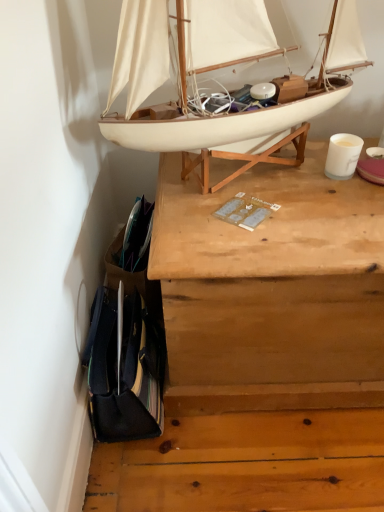
You are a GUI agent. You are given a task and a screenshot of the screen. Output one action in this format:
    pyautogui.click(x=<x>, y=<y>)
    Task: Click on the white matte boat at upper center
    
    Given the screenshot: What is the action you would take?
    pyautogui.click(x=219, y=114)

This screenshot has width=384, height=512. What do you see at coordinates (219, 114) in the screenshot?
I see `white matte boat at upper center` at bounding box center [219, 114].

The height and width of the screenshot is (512, 384). What do you see at coordinates (266, 324) in the screenshot?
I see `wooden chest at upper center` at bounding box center [266, 324].

From the picture: Measure the distance between point (x=233, y=258) and camera.

Point (x=233, y=258) is 29.06 inches from camera.

Find the location of a particular element. wooden chest at upper center is located at coordinates (266, 324).

Locate an element on the screen. white matte boat at upper center is located at coordinates point(219,114).

Does wooden chest at upper center appear on the right side of white matte boat at upper center?

Yes.

Is the depth of wooden chest at upper center greater than that of white matte boat at upper center?

Yes, wooden chest at upper center is behind white matte boat at upper center.

Does point (202, 426) appear closer or farther from the camera than point (227, 133)?

Point (202, 426) is positioned farther from the camera compared to point (227, 133).

Looking at this image, from the image's perspective, which object appears higher, wooden chest at upper center or white matte boat at upper center?

white matte boat at upper center.

From a real-world perspective, is wooden chest at upper center physically above white matte boat at upper center?

No, from a real-world perspective, wooden chest at upper center is not on top of white matte boat at upper center.

Considering the relative sizes of wooden chest at upper center and white matte boat at upper center in the image provided, is wooden chest at upper center wider than white matte boat at upper center?

Yes.

Does wooden chest at upper center have a lesser height compared to white matte boat at upper center?

No, wooden chest at upper center is not shorter than white matte boat at upper center.

Can you confirm if wooden chest at upper center is bigger than white matte boat at upper center?

Correct, wooden chest at upper center is larger in size than white matte boat at upper center.

Is wooden chest at upper center inside or outside of white matte boat at upper center?

wooden chest at upper center is located beyond the bounds of white matte boat at upper center.

From the picture: Is there a large distance between wooden chest at upper center and white matte boat at upper center?

No, wooden chest at upper center is in close proximity to white matte boat at upper center.

Could you tell me if wooden chest at upper center is turned towards white matte boat at upper center?

No, wooden chest at upper center does not turn towards white matte boat at upper center.

What's the angular difference between wooden chest at upper center and white matte boat at upper center's facing directions?

There is a 0.266-degree angle between the facing directions of wooden chest at upper center and white matte boat at upper center.

Measure the distance between wooden chest at upper center and white matte boat at upper center.

The distance of wooden chest at upper center from white matte boat at upper center is 13.53 inches.

You are a GUI agent. You are given a task and a screenshot of the screen. Output one action in this format:
    pyautogui.click(x=<x>, y=<y>)
    Task: Click on the desk below the white matte boat at upper center (from a real-world perspective)
    This screenshot has height=512, width=384.
    Given the screenshot: What is the action you would take?
    pyautogui.click(x=266, y=324)

Between white matte boat at upper center and wooden chest at upper center, which one appears on the right side from the viewer's perspective?

wooden chest at upper center is more to the right.

Relative to wooden chest at upper center, is white matte boat at upper center in front or behind?

Clearly, white matte boat at upper center is in front of wooden chest at upper center.

Does point (207, 58) lie in front of point (164, 485)?

Yes, point (207, 58) is in front of point (164, 485).

From the image's perspective, is white matte boat at upper center above or below wooden chest at upper center?

From the image's perspective, white matte boat at upper center appears above wooden chest at upper center.

From a real-world perspective, is white matte boat at upper center positioned above or below wooden chest at upper center?

From a real-world perspective, white matte boat at upper center is physically above wooden chest at upper center.

Considering the sizes of objects white matte boat at upper center and wooden chest at upper center in the image provided, who is wider, white matte boat at upper center or wooden chest at upper center?

With larger width is wooden chest at upper center.

Between white matte boat at upper center and wooden chest at upper center, which one has less height?

white matte boat at upper center.

Considering the sizes of objects white matte boat at upper center and wooden chest at upper center in the image provided, who is smaller, white matte boat at upper center or wooden chest at upper center?

white matte boat at upper center.

Which is correct: white matte boat at upper center is inside wooden chest at upper center, or outside of it?

white matte boat at upper center is not enclosed by wooden chest at upper center.

Is white matte boat at upper center beside wooden chest at upper center?

No, white matte boat at upper center is not with wooden chest at upper center.

Is white matte boat at upper center positioned with its back to wooden chest at upper center?

That's not correct — white matte boat at upper center is not looking away from wooden chest at upper center.

How many degrees apart are the facing directions of white matte boat at upper center and wooden chest at upper center?

There is a 0.266-degree angle between the facing directions of white matte boat at upper center and wooden chest at upper center.

Identify the location of desk located behind the white matte boat at upper center. (266, 324).

I want to click on boat that appears in front of the wooden chest at upper center, so click(219, 114).

The image size is (384, 512). In order to click on boat above the wooden chest at upper center (from the image's perspective) in this screenshot , I will do [219, 114].